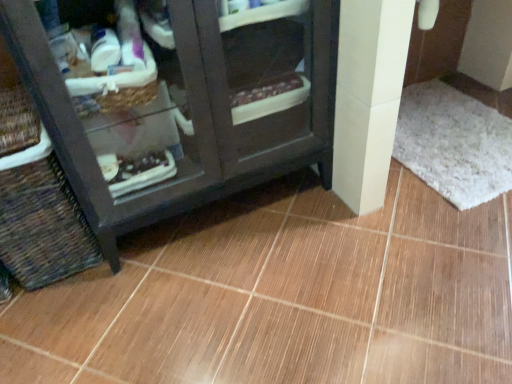
Question: From the image's perspective, would you say white shaggy bath mat at lower right is positioned over woven brown basket at lower left?

Choices:
 (A) no
 (B) yes

Answer: (B)

Question: Does white shaggy bath mat at lower right lie in front of woven brown basket at lower left?

Choices:
 (A) no
 (B) yes

Answer: (A)

Question: Is white shaggy bath mat at lower right oriented away from woven brown basket at lower left?

Choices:
 (A) no
 (B) yes

Answer: (A)

Question: Can you see white shaggy bath mat at lower right touching woven brown basket at lower left?

Choices:
 (A) no
 (B) yes

Answer: (A)

Question: Is white shaggy bath mat at lower right behind woven brown basket at lower left?

Choices:
 (A) yes
 (B) no

Answer: (A)

Question: Considering the positions of woven brown basket at lower left and white shaggy bath mat at lower right in the image, is woven brown basket at lower left wider or thinner than white shaggy bath mat at lower right?

Choices:
 (A) wide
 (B) thin

Answer: (B)

Question: Is point pos(19,183) positioned closer to the camera than point pos(436,79)?

Choices:
 (A) farther
 (B) closer

Answer: (B)

Question: Is woven brown basket at lower left situated inside white shaggy bath mat at lower right or outside?

Choices:
 (A) outside
 (B) inside

Answer: (A)

Question: Considering their positions, is woven brown basket at lower left located in front of or behind white shaggy bath mat at lower right?

Choices:
 (A) behind
 (B) front

Answer: (B)

Question: Is brown glossy tile at center in front of or behind woven brown basket at lower left in the image?

Choices:
 (A) front
 (B) behind

Answer: (A)

Question: In terms of width, does brown glossy tile at center look wider or thinner when compared to woven brown basket at lower left?

Choices:
 (A) thin
 (B) wide

Answer: (B)

Question: Is brown glossy tile at center spatially inside woven brown basket at lower left, or outside of it?

Choices:
 (A) outside
 (B) inside

Answer: (A)

Question: Is point (328, 301) positioned closer to the camera than point (76, 235)?

Choices:
 (A) closer
 (B) farther

Answer: (A)

Question: Is point (494, 178) positioned closer to the camera than point (250, 97)?

Choices:
 (A) closer
 (B) farther

Answer: (B)

Question: In the image, is white shaggy bath mat at lower right positioned in front of or behind dark wood cabinet at lower left?

Choices:
 (A) front
 (B) behind

Answer: (B)